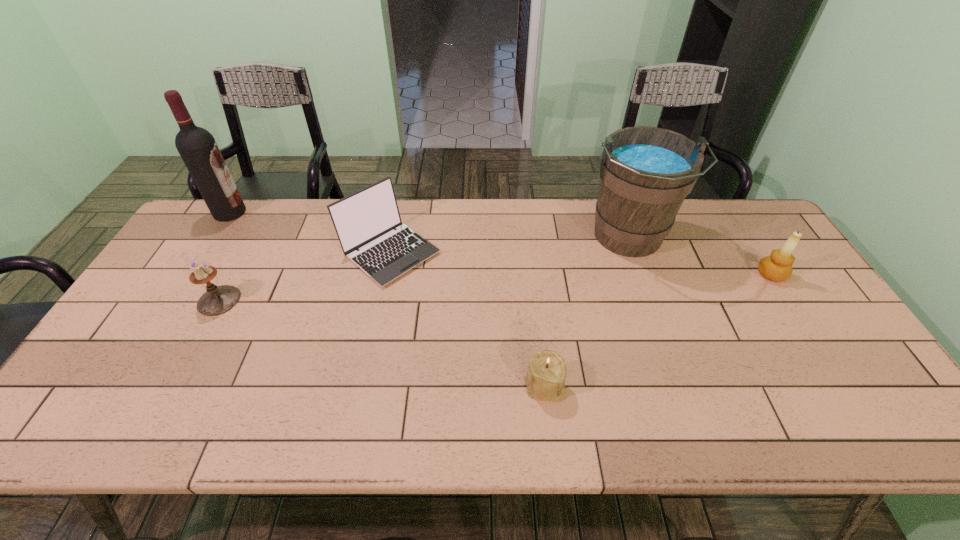
Select which candle_holder is the second closest to the second object from right to left. Please provide its 2D coordinates. Your answer should be formatted as a tuple, i.e. [(x, y)], where the tuple contains the x and y coordinates of a point satisfying the conditions above.

[(545, 379)]

The width and height of the screenshot is (960, 540). In order to click on candle_holder that stands as the closest to the laptop_computer in this screenshot , I will do click(217, 300).

This screenshot has width=960, height=540. What are the coordinates of `vacant area that satisfies the following two spatial constraints: 1. on the label of the tallest object; 2. on the back side of the rightmost candle_holder` in the screenshot? It's located at (190, 275).

Locate an element on the screen. This screenshot has height=540, width=960. free space that satisfies the following two spatial constraints: 1. on the label of the second object from left to right; 2. on the left side of the leftmost object is located at coordinates (174, 300).

Identify the location of free region that satisfies the following two spatial constraints: 1. on the label of the second object from left to right; 2. on the left side of the tallest object. The image size is (960, 540). (174, 300).

The height and width of the screenshot is (540, 960). I want to click on vacant space that satisfies the following two spatial constraints: 1. on the label of the leftmost object; 2. on the left side of the second object from left to right, so click(x=174, y=300).

Where is `free space that satisfies the following two spatial constraints: 1. on the label of the wine bottle; 2. on the right side of the rightmost candle_holder`? The height and width of the screenshot is (540, 960). free space that satisfies the following two spatial constraints: 1. on the label of the wine bottle; 2. on the right side of the rightmost candle_holder is located at coordinates (190, 275).